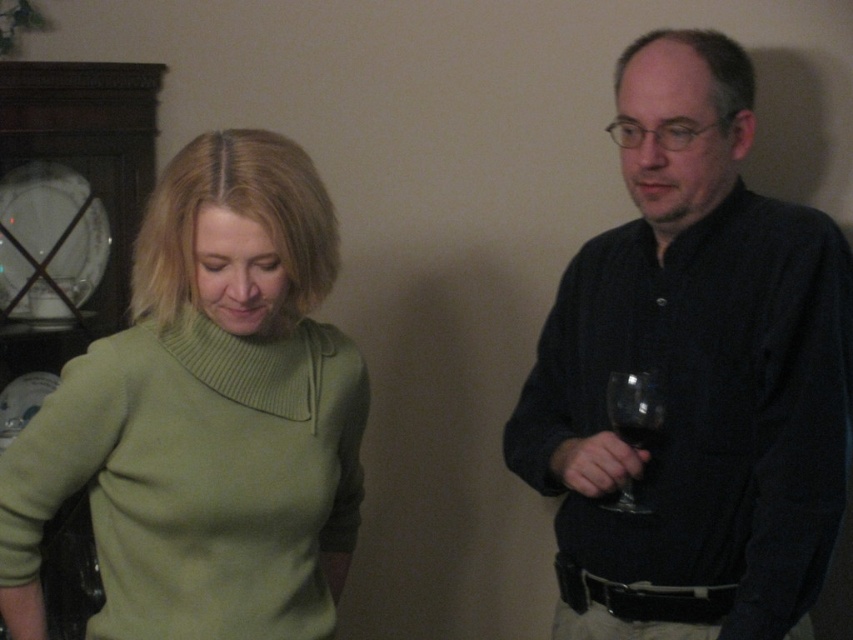
Question: Which point is closer to the camera?

Choices:
 (A) green knitted sweater at left
 (B) matte black shirt at right

Answer: (A)

Question: Which of the following is the closest to the observer?

Choices:
 (A) (177, 232)
 (B) (614, 500)

Answer: (A)

Question: Among these points, which one is nearest to the camera?

Choices:
 (A) (91, 524)
 (B) (665, 428)

Answer: (A)

Question: Is matte black shirt at right smaller than green knitted sweater at left?

Choices:
 (A) yes
 (B) no

Answer: (B)

Question: Is the position of green knitted sweater at left more distant than that of transparent glass wine glass at right?

Choices:
 (A) yes
 (B) no

Answer: (B)

Question: Can you confirm if green knitted sweater at left is positioned to the left of transparent glass wine glass at right?

Choices:
 (A) no
 (B) yes

Answer: (B)